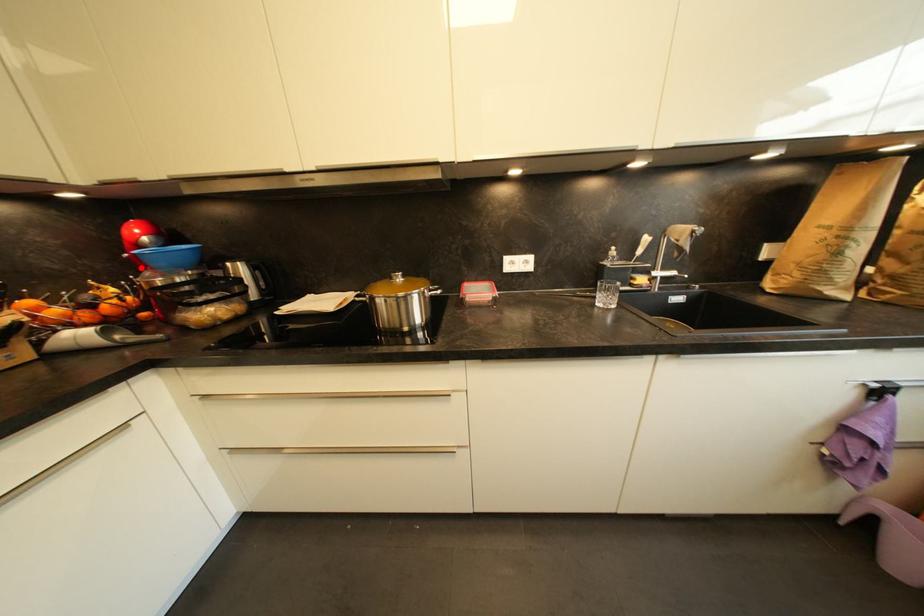
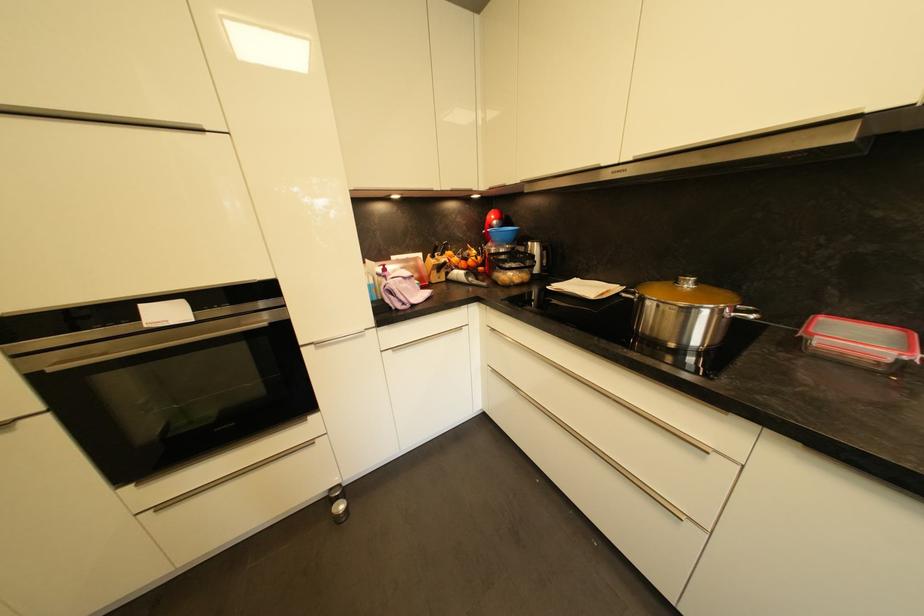
The point at the highlighted location is marked in the first image. Where is the corresponding point in the second image?

(492, 240)